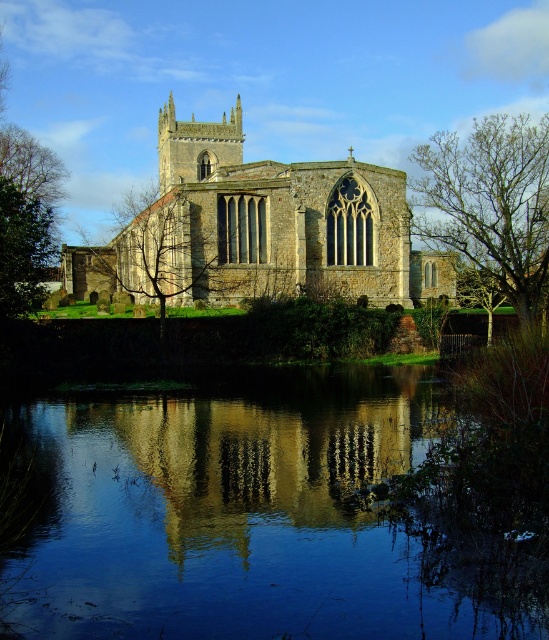
Question: Does bare wood tree at right appear over green leafy tree at left?

Choices:
 (A) no
 (B) yes

Answer: (B)

Question: Estimate the real-world distances between objects in this image. Which object is closer to the green leafy tree at left?

Choices:
 (A) stone church at center
 (B) bare wood tree at right

Answer: (A)

Question: Is transparent glass water at center closer to the viewer compared to stone church at center?

Choices:
 (A) no
 (B) yes

Answer: (B)

Question: Can you confirm if stone church at center is positioned below green leafy tree at center?

Choices:
 (A) no
 (B) yes

Answer: (A)

Question: Which of the following is the farthest from the observer?

Choices:
 (A) (216, 230)
 (B) (540, 132)
 (C) (20, 225)

Answer: (B)

Question: Which point is farther to the camera?

Choices:
 (A) (237, 189)
 (B) (19, 193)

Answer: (A)